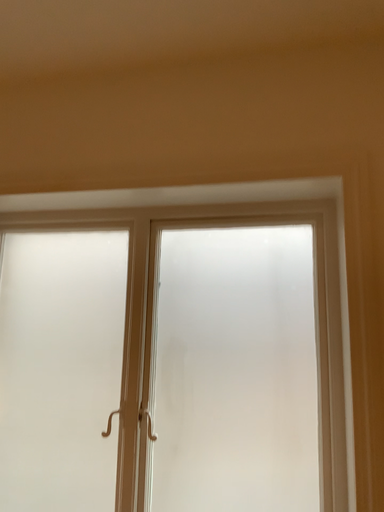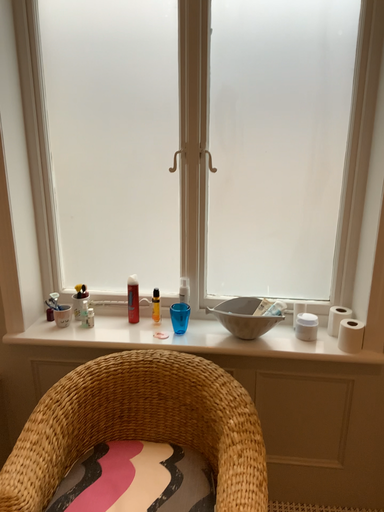
Question: How did the camera likely rotate when shooting the video?

Choices:
 (A) rotated right
 (B) rotated left

Answer: (A)